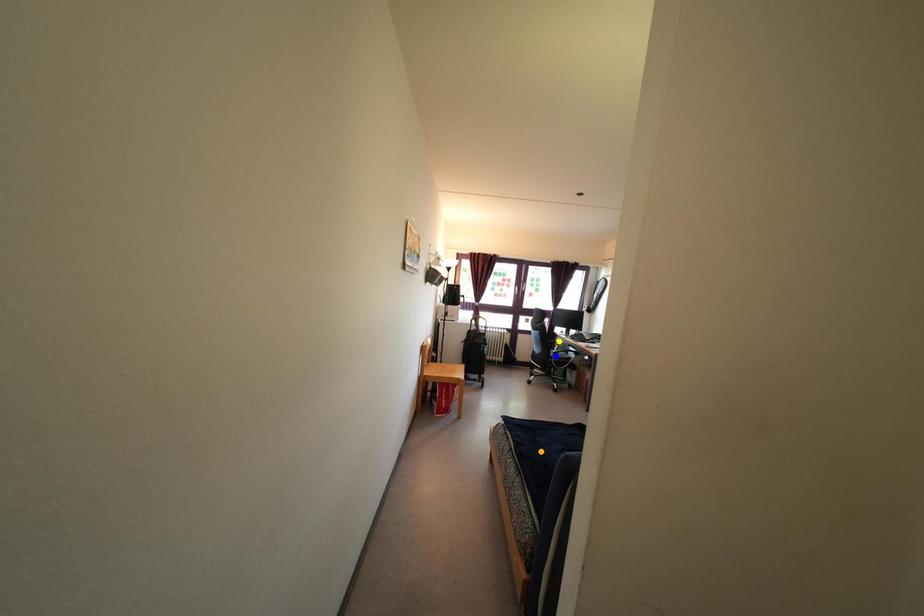
Order these from nearest to farthest:
A) blue point
B) yellow point
C) orange point

orange point → blue point → yellow point